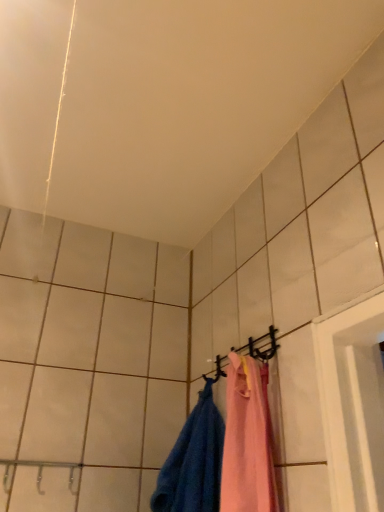
Question: From the image's perspective, is blue cotton towel at lower right above or below black matte hanger at upper center?

Choices:
 (A) above
 (B) below

Answer: (B)

Question: Relative to black matte hanger at upper center, is blue cotton towel at lower right in front or behind?

Choices:
 (A) front
 (B) behind

Answer: (A)

Question: From a real-world perspective, is blue cotton towel at lower right above or below black matte hanger at upper center?

Choices:
 (A) above
 (B) below

Answer: (B)

Question: Which is correct: black matte hanger at upper center is inside blue cotton towel at lower right, or outside of it?

Choices:
 (A) inside
 (B) outside

Answer: (B)

Question: Visually, is black matte hanger at upper center positioned to the left or to the right of blue cotton towel at lower right?

Choices:
 (A) left
 (B) right

Answer: (B)

Question: Considering the positions of black matte hanger at upper center and blue cotton towel at lower right in the image, is black matte hanger at upper center wider or thinner than blue cotton towel at lower right?

Choices:
 (A) wide
 (B) thin

Answer: (B)

Question: Is black matte hanger at upper center in front of or behind blue cotton towel at lower right in the image?

Choices:
 (A) front
 (B) behind

Answer: (B)